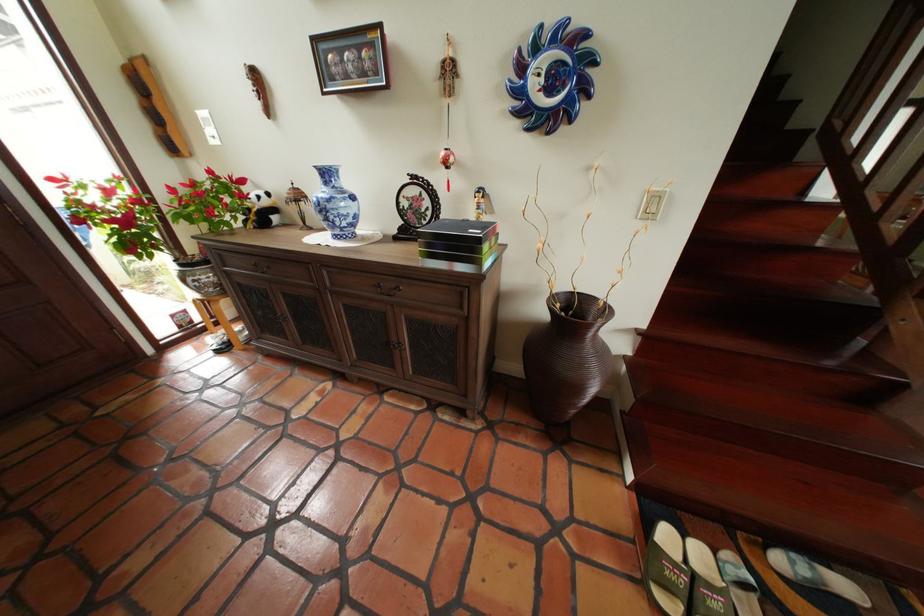
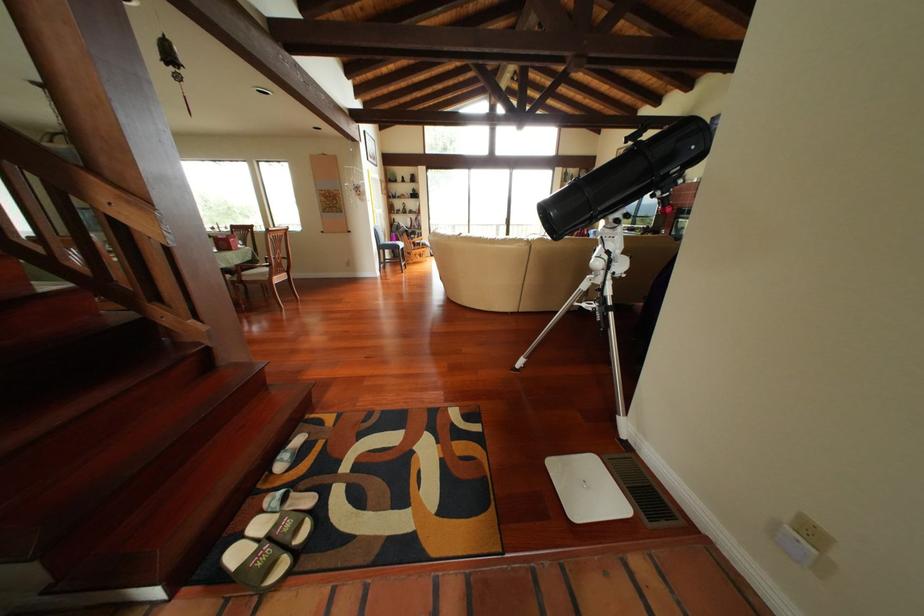
How did the camera likely rotate?

The camera rotated toward right-down.